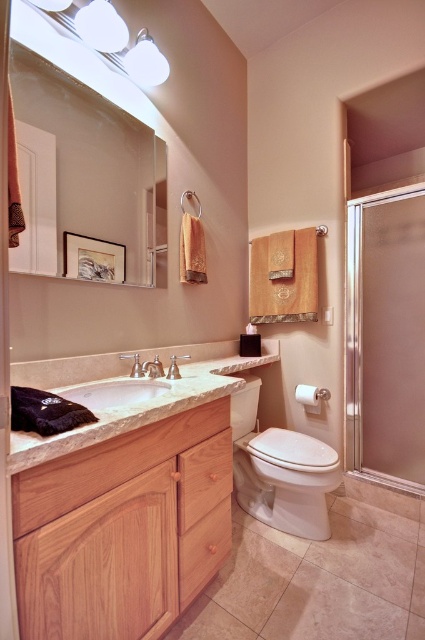
Who is higher up, frosted glass shower door at right or white glossy toilet at center?

Positioned higher is frosted glass shower door at right.

Who is more distant from viewer, (345,307) or (312,484)?

The point (345,307) is behind.

At what (x,y) coordinates should I click in order to perform the action: click on frosted glass shower door at right. Please return your answer as a coordinate pair (x, y). The width and height of the screenshot is (425, 640). Looking at the image, I should click on (385, 337).

Is white marble sink at center thinner than wooden towel bar at center?

No.

Is white marble sink at center shorter than wooden towel bar at center?

Correct, white marble sink at center is not as tall as wooden towel bar at center.

Is point (104, 408) closer to viewer compared to point (311, 396)?

Yes.

This screenshot has width=425, height=640. I want to click on white marble sink at center, so click(115, 392).

Which is more to the right, white glossy toilet at center or white marble sink at center?

white glossy toilet at center

Can you confirm if white glossy toilet at center is taller than white marble sink at center?

Yes.

Find the location of a particular element. white glossy toilet at center is located at coordinates (280, 472).

The height and width of the screenshot is (640, 425). Find the location of `white glossy toilet at center`. white glossy toilet at center is located at coordinates (280, 472).